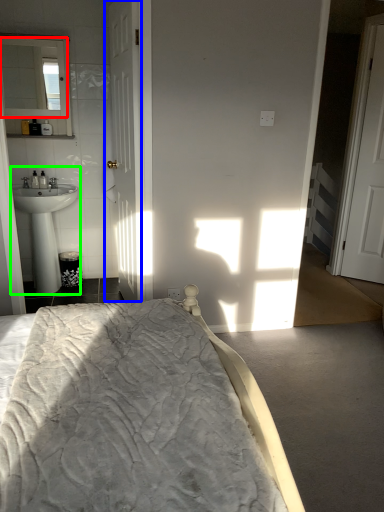
Question: Based on their relative distances, which object is farther from mirror (highlighted by a red box)? Choose from door (highlighted by a blue box) and sink (highlighted by a green box).

Choices:
 (A) door
 (B) sink

Answer: (B)